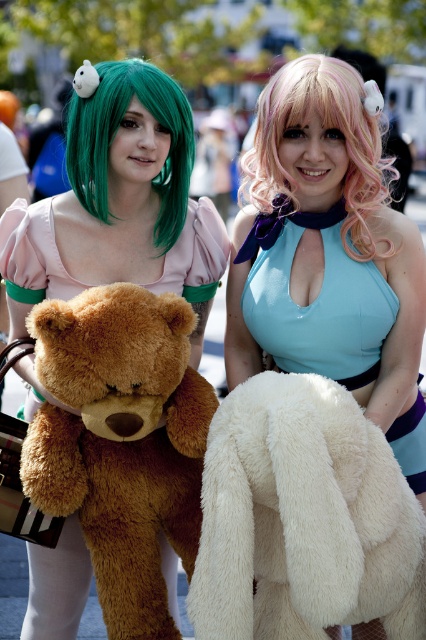
Based on the photo, between fluffy white plush at center and brown plush teddy bear at left, which one has more height?

With more height is fluffy white plush at center.

Is fluffy white plush at center positioned in front of brown plush teddy bear at left?

That is False.

Does point (391, 227) lie in front of point (97, 404)?

No, it is behind (97, 404).

Image resolution: width=426 pixels, height=640 pixels. I want to click on fluffy white plush at center, so click(328, 253).

Is fluffy white plush at center in front of light blue satin dress at center?

Yes, it is in front of light blue satin dress at center.

Between point (307, 156) and point (330, 218), which one is positioned in front?

Positioned in front is point (307, 156).

At what (x,y) coordinates should I click in order to perform the action: click on fluffy white plush at center. Please return your answer as a coordinate pair (x, y). Looking at the image, I should click on (328, 253).

Is pink wavy wig at upper center wider than green matte wig at upper left?

Indeed, pink wavy wig at upper center has a greater width compared to green matte wig at upper left.

Who is shorter, pink wavy wig at upper center or green matte wig at upper left?

Standing shorter between the two is green matte wig at upper left.

Is point (247, 179) farther from viewer compared to point (115, 83)?

Yes, it is behind point (115, 83).

The width and height of the screenshot is (426, 640). I want to click on pink wavy wig at upper center, so click(x=330, y=128).